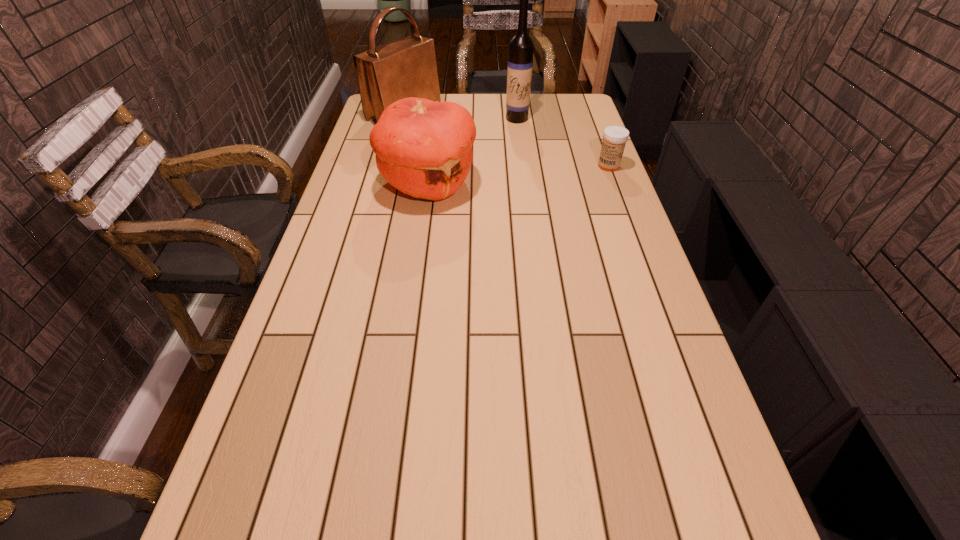
Find the location of a particular element. Image resolution: width=960 pixels, height=540 pixels. vacant area at the near edge is located at coordinates (426, 491).

In order to click on free space at the left edge of the desktop in this screenshot , I will do `click(303, 333)`.

Identify the location of blank space at the right edge. (697, 387).

The width and height of the screenshot is (960, 540). Identify the location of vacant region at the far right corner. (568, 117).

This screenshot has height=540, width=960. I want to click on vacant space in between the second shortest object and the second object from right to left, so (472, 151).

At what (x,y) coordinates should I click in order to perform the action: click on blank region between the pumpkin and the third object from left to right. Please return your answer as a coordinate pair (x, y). Image resolution: width=960 pixels, height=540 pixels. Looking at the image, I should click on (472, 151).

At what (x,y) coordinates should I click in order to perform the action: click on vacant area that lies between the medicine and the wine bottle. Please return your answer as a coordinate pair (x, y). This screenshot has height=540, width=960. Looking at the image, I should click on (563, 142).

Locate an element on the screen. The width and height of the screenshot is (960, 540). free spot between the third shortest object and the rightmost object is located at coordinates (507, 141).

Find the location of a particular element. The height and width of the screenshot is (540, 960). unoccupied position between the shortest object and the shoulder bag is located at coordinates (507, 141).

Find the location of a particular element. vacant area between the shortest object and the pumpkin is located at coordinates (518, 175).